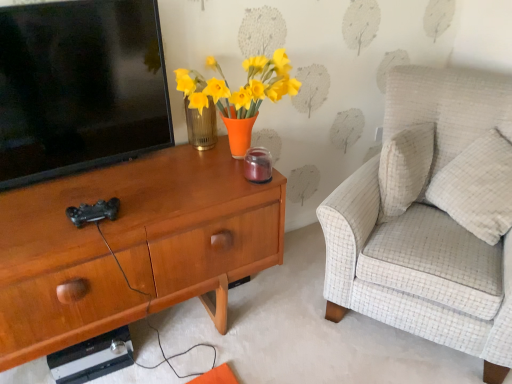
Question: Is white textured pillow at right wider or thinner than light beige fabric armchair at right?

Choices:
 (A) thin
 (B) wide

Answer: (A)

Question: From the image's perspective, is white textured pillow at right above or below light beige fabric armchair at right?

Choices:
 (A) above
 (B) below

Answer: (A)

Question: Estimate the real-world distances between objects in this image. Which object is farther from the light beige fabric armchair at right?

Choices:
 (A) woodendesk at left
 (B) black glossy television at left
 (C) white textured pillow at right

Answer: (B)

Question: Considering the real-world distances, which object is farthest from the woodendesk at left?

Choices:
 (A) black glossy television at left
 (B) white textured pillow at right
 (C) light beige fabric armchair at right

Answer: (B)